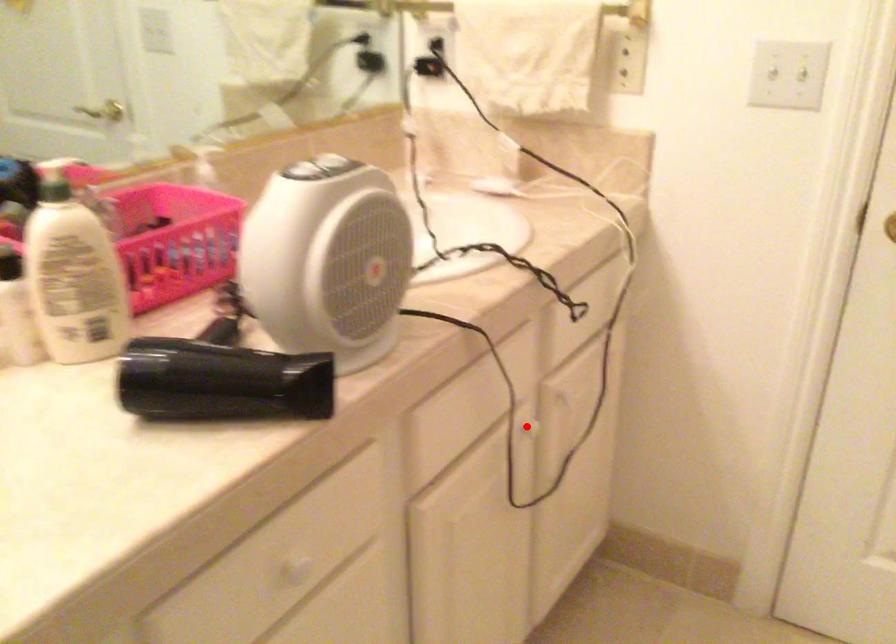
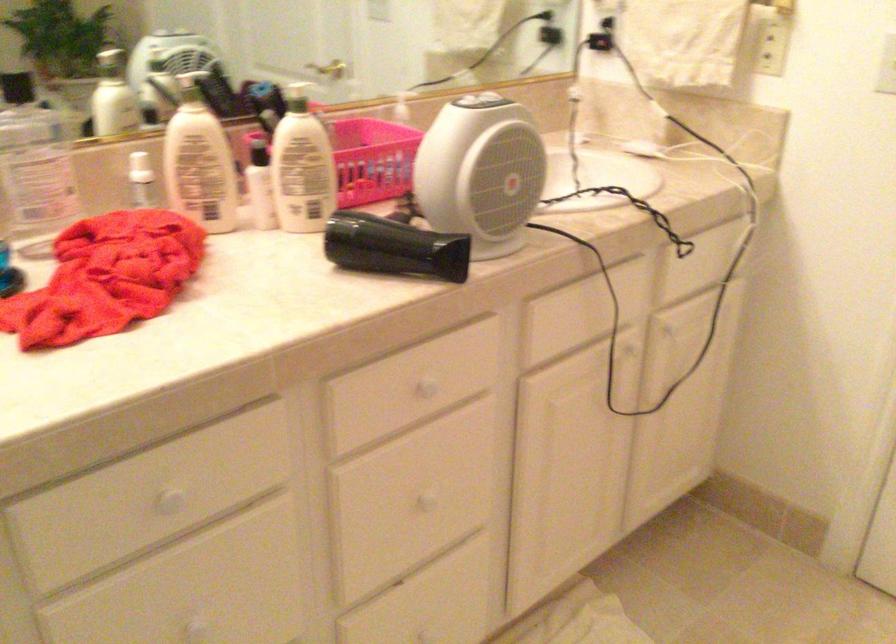
Question: I am providing you with two images of the same scene from different viewpoints. In image1, a red point is highlighted. Considering the same 3D point in image2, which of the following is correct?

Choices:
 (A) It is closer
 (B) It is farther

Answer: (B)